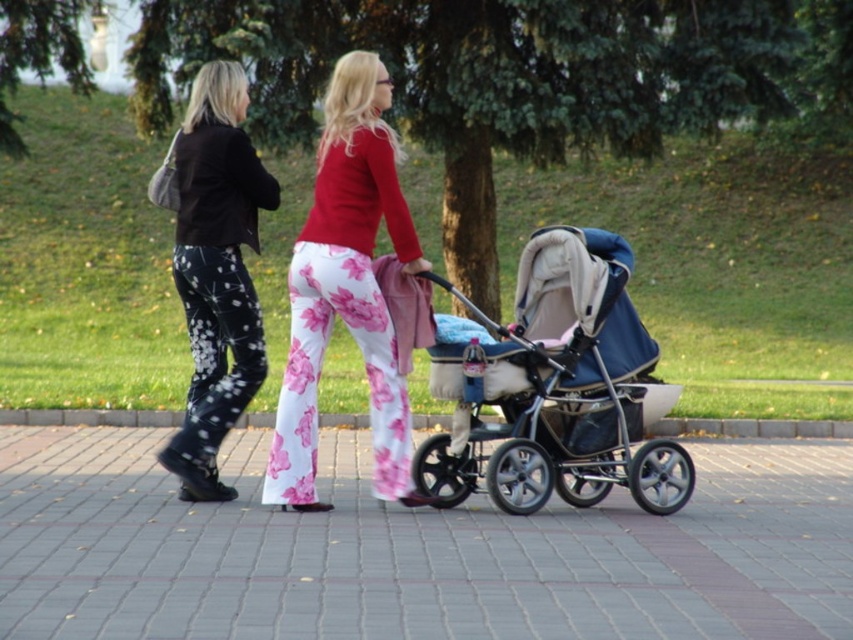
Question: Among these points, which one is farthest from the camera?

Choices:
 (A) (326, 26)
 (B) (343, 136)

Answer: (A)

Question: Estimate the real-world distances between objects in this image. Which object is farther from the blue fabric stroller at center?

Choices:
 (A) blue fabric baby carriage at center
 (B) black matte pants at left

Answer: (B)

Question: Can you confirm if gray concrete pavement at center is positioned below black matte pants at left?

Choices:
 (A) no
 (B) yes

Answer: (B)

Question: Which point appears closest to the camera in this image?

Choices:
 (A) (173, 272)
 (B) (310, 292)
 (C) (381, 232)

Answer: (B)

Question: Does blue fabric stroller at center appear under blue fabric baby carriage at center?

Choices:
 (A) no
 (B) yes

Answer: (A)

Question: Does blue fabric stroller at center have a lesser width compared to blue fabric baby carriage at center?

Choices:
 (A) yes
 (B) no

Answer: (B)